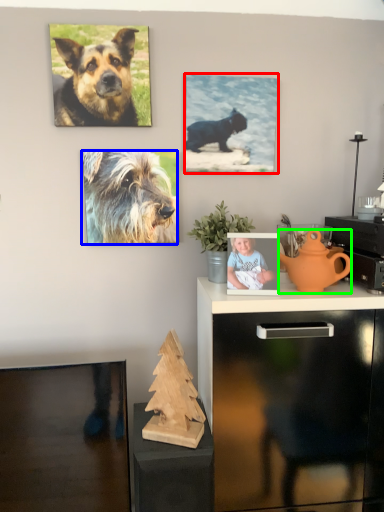
Question: Which object is the farthest from picture frame (highlighted by a red box)? Choose among these: dog (highlighted by a blue box) or teapot (highlighted by a green box).

Choices:
 (A) dog
 (B) teapot

Answer: (B)